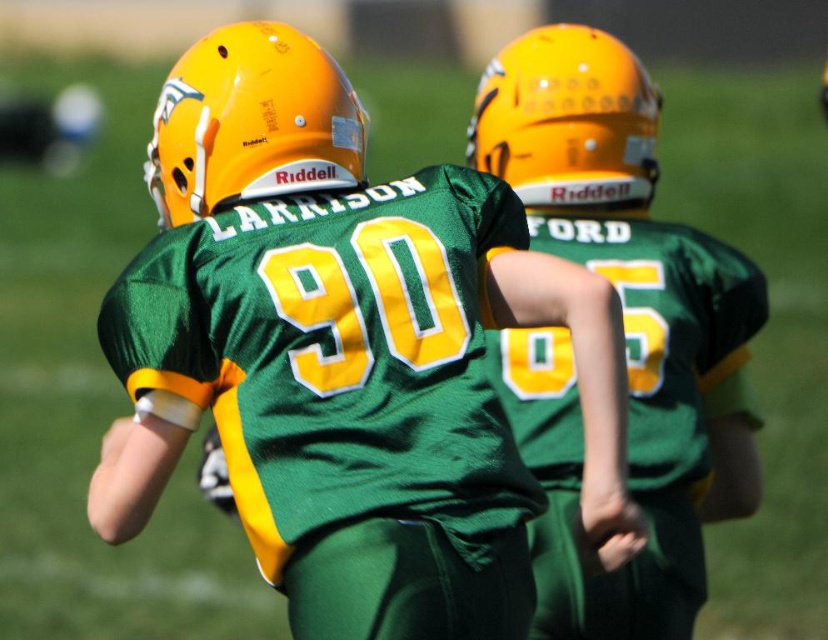
Who is positioned more to the left, matte yellow helmet at upper center or matte orange helmet at upper center?

Positioned to the left is matte yellow helmet at upper center.

Who is higher up, matte yellow helmet at upper center or matte orange helmet at upper center?

matte orange helmet at upper center is higher up.

Is point (363, 141) closer to camera compared to point (591, 68)?

Yes, it is.

Where is `matte yellow helmet at upper center`? This screenshot has width=828, height=640. matte yellow helmet at upper center is located at coordinates (251, 122).

Does matte green jersey at center have a larger size compared to matte yellow helmet at upper center?

Indeed, matte green jersey at center has a larger size compared to matte yellow helmet at upper center.

Is matte green jersey at center smaller than matte yellow helmet at upper center?

Incorrect, matte green jersey at center is not smaller in size than matte yellow helmet at upper center.

The image size is (828, 640). What are the coordinates of `matte green jersey at center` in the screenshot? It's located at (624, 330).

Does matte green jersey at center have a greater height compared to matte orange helmet at upper center?

Yes.

This screenshot has width=828, height=640. What do you see at coordinates (624, 330) in the screenshot?
I see `matte green jersey at center` at bounding box center [624, 330].

I want to click on matte green jersey at center, so click(x=624, y=330).